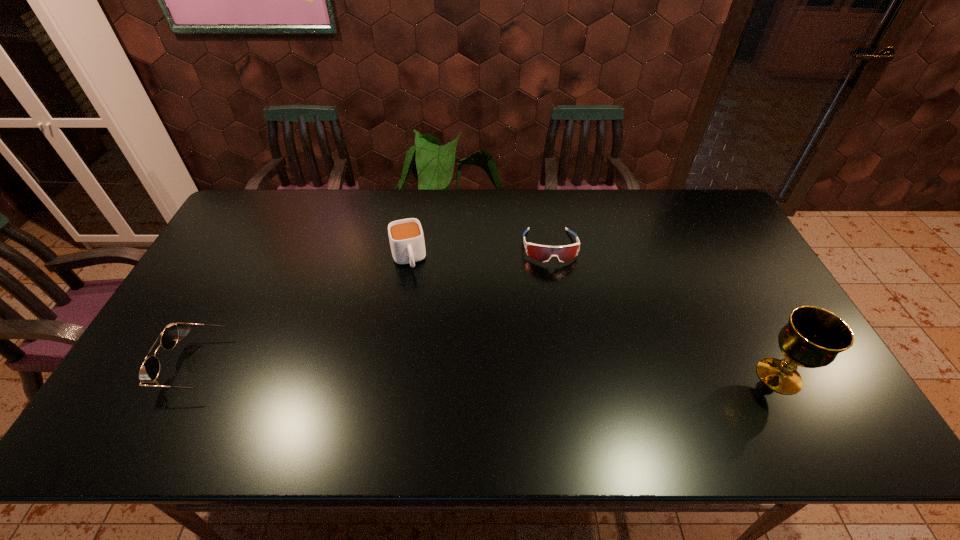
The width and height of the screenshot is (960, 540). Find the location of `free point located 0.300m on the side with the handle of the cup`. free point located 0.300m on the side with the handle of the cup is located at coordinates (430, 356).

This screenshot has height=540, width=960. I want to click on free location located on the side with the handle of the cup, so click(x=424, y=332).

The width and height of the screenshot is (960, 540). In order to click on free space located 0.220m on the front-facing side of the shortest object in this screenshot , I will do `click(562, 322)`.

You are a GUI agent. You are given a task and a screenshot of the screen. Output one action in this format:
    pyautogui.click(x=<x>, y=<y>)
    Task: Click on the vacant region located on the front-facing side of the shortest object
    
    Given the screenshot: What is the action you would take?
    pyautogui.click(x=563, y=328)

Find the location of `vacant space located on the front-facing side of the shortest object`. vacant space located on the front-facing side of the shortest object is located at coordinates (562, 326).

In order to click on object that is positioned at the far edge in this screenshot , I will do `click(542, 253)`.

I want to click on sunglasses that is at the near edge, so click(149, 371).

The height and width of the screenshot is (540, 960). Identify the location of chalice at the near edge. (813, 337).

Locate an element on the screen. object present at the left edge is located at coordinates (149, 371).

Identify the location of object at the right edge. The image size is (960, 540). (813, 337).